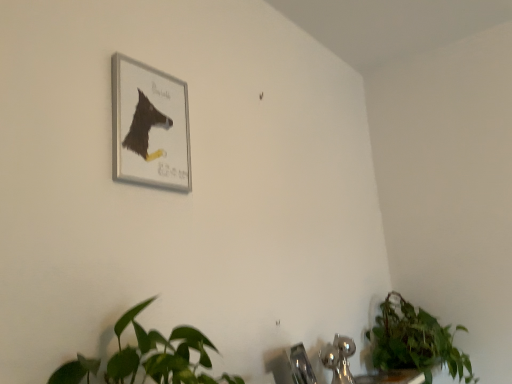
Question: Does green leafy plant at lower right lie behind chrome metallic sink at lower center?

Choices:
 (A) yes
 (B) no

Answer: (A)

Question: Does green leafy plant at lower right have a lesser width compared to chrome metallic sink at lower center?

Choices:
 (A) yes
 (B) no

Answer: (B)

Question: Does green leafy plant at lower right contain chrome metallic sink at lower center?

Choices:
 (A) no
 (B) yes

Answer: (A)

Question: Can you confirm if green leafy plant at lower right is smaller than chrome metallic sink at lower center?

Choices:
 (A) yes
 (B) no

Answer: (B)

Question: Is green leafy plant at lower right far from chrome metallic sink at lower center?

Choices:
 (A) no
 (B) yes

Answer: (A)

Question: From a real-world perspective, is chrome metallic sink at lower center positioned above or below silver metallic picture frame at upper left?

Choices:
 (A) below
 (B) above

Answer: (A)

Question: Is chrome metallic sink at lower center in front of or behind silver metallic picture frame at upper left in the image?

Choices:
 (A) behind
 (B) front

Answer: (A)

Question: Considering the positions of chrome metallic sink at lower center and silver metallic picture frame at upper left in the image, is chrome metallic sink at lower center bigger or smaller than silver metallic picture frame at upper left?

Choices:
 (A) small
 (B) big

Answer: (B)

Question: Considering the positions of chrome metallic sink at lower center and silver metallic picture frame at upper left in the image, is chrome metallic sink at lower center taller or shorter than silver metallic picture frame at upper left?

Choices:
 (A) short
 (B) tall

Answer: (A)

Question: From a real-world perspective, is chrome metallic sink at lower center above or below satin nickel faucet at lower center?

Choices:
 (A) below
 (B) above

Answer: (B)

Question: Considering the relative positions of chrome metallic sink at lower center and satin nickel faucet at lower center in the image provided, is chrome metallic sink at lower center to the left or to the right of satin nickel faucet at lower center?

Choices:
 (A) right
 (B) left

Answer: (A)

Question: In terms of size, does chrome metallic sink at lower center appear bigger or smaller than satin nickel faucet at lower center?

Choices:
 (A) small
 (B) big

Answer: (B)

Question: Considering the positions of chrome metallic sink at lower center and satin nickel faucet at lower center in the image, is chrome metallic sink at lower center taller or shorter than satin nickel faucet at lower center?

Choices:
 (A) short
 (B) tall

Answer: (A)

Question: Considering their positions, is green leafy plant at lower right located in front of or behind satin nickel faucet at lower center?

Choices:
 (A) behind
 (B) front

Answer: (A)

Question: Considering the positions of green leafy plant at lower right and satin nickel faucet at lower center in the image, is green leafy plant at lower right taller or shorter than satin nickel faucet at lower center?

Choices:
 (A) short
 (B) tall

Answer: (B)